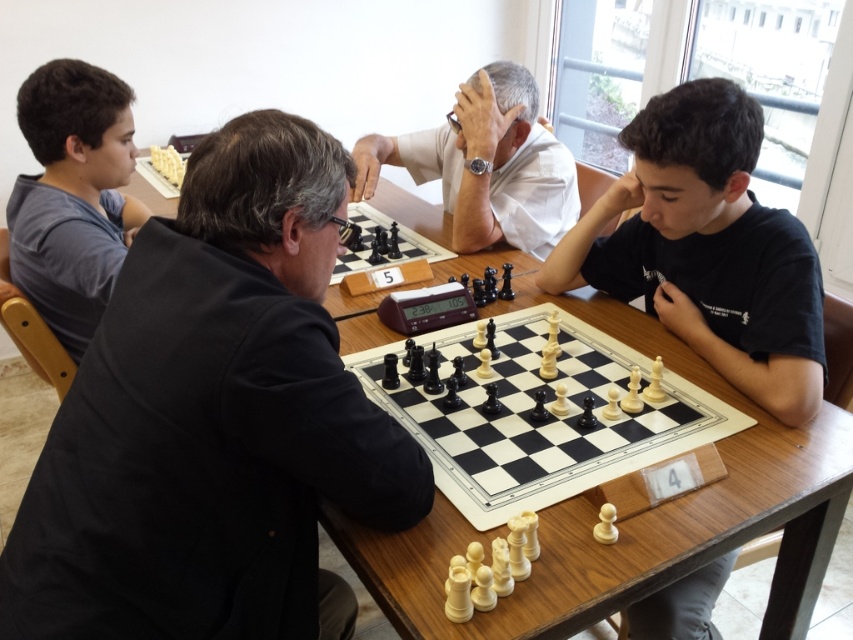
Question: Is wooden table at center smaller than wooden chessboard at center?

Choices:
 (A) no
 (B) yes

Answer: (A)

Question: Considering the real-world distances, which object is farthest from the gray cotton shirt at left?

Choices:
 (A) black fabric shirt at left
 (B) wooden chessboard at center
 (C) white smooth shirt at center

Answer: (C)

Question: Which point is farther to the camera?

Choices:
 (A) black fabric shirt at left
 (B) white smooth shirt at center

Answer: (B)

Question: Is wooden chessboard at center wider than white smooth shirt at center?

Choices:
 (A) no
 (B) yes

Answer: (B)

Question: Estimate the real-world distances between objects in this image. Which object is farther from the white smooth shirt at center?

Choices:
 (A) black fabric shirt at left
 (B) wooden table at center

Answer: (A)

Question: Does black fabric shirt at left appear on the left side of wooden chessboard at center?

Choices:
 (A) yes
 (B) no

Answer: (A)